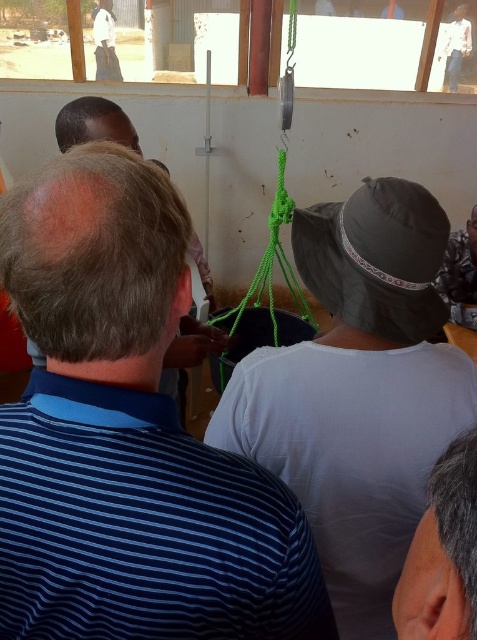
Question: Does white cotton shirt at center have a larger size compared to gray hair at lower right?

Choices:
 (A) yes
 (B) no

Answer: (A)

Question: Does blue striped shirt at center have a larger size compared to white cotton shirt at upper left?

Choices:
 (A) no
 (B) yes

Answer: (B)

Question: Which of the following is the closest to the observer?

Choices:
 (A) (102, 36)
 (B) (121, 200)

Answer: (B)

Question: Which point is farther to the camera?

Choices:
 (A) gray hair at lower right
 (B) white cotton shirt at upper right

Answer: (B)

Question: Does white cotton shirt at center appear over white cotton shirt at upper right?

Choices:
 (A) yes
 (B) no

Answer: (B)

Question: Which of the following is the farthest from the observer?

Choices:
 (A) (435, 604)
 (B) (460, 19)
 (C) (86, 241)

Answer: (B)